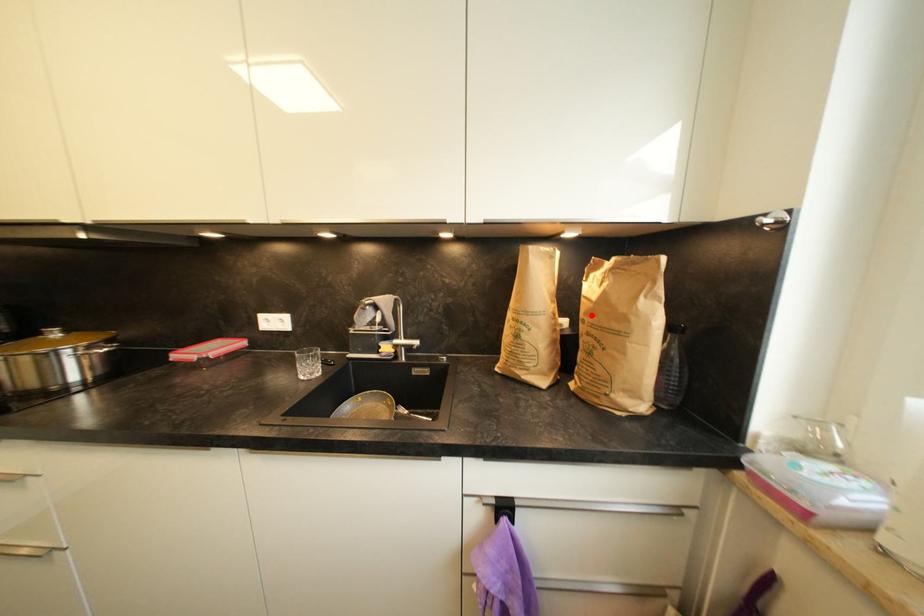
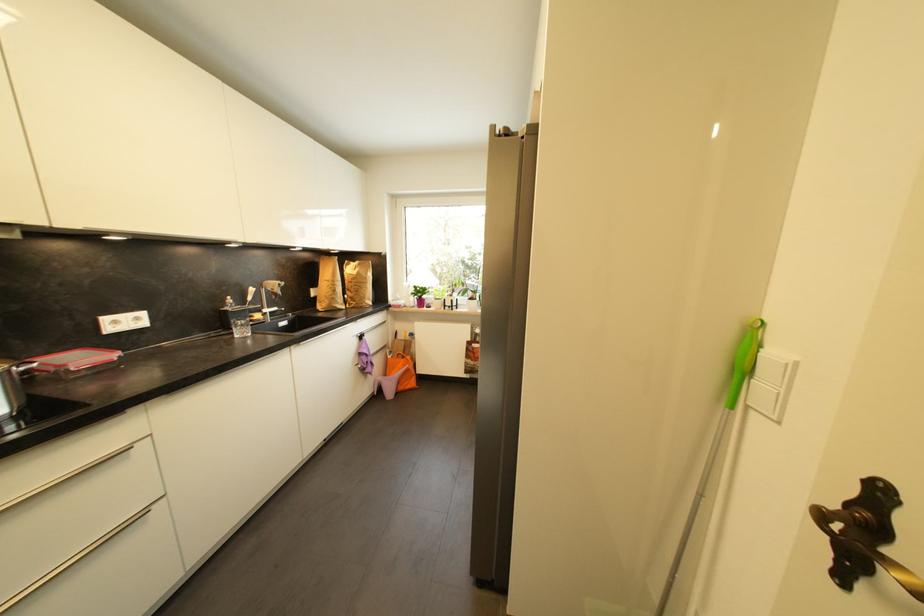
Question: I am providing you with two images of the same scene from different viewpoints. A red point is shown in image1. For the corresponding object point in image2, is it positioned nearer or farther from the camera?

Choices:
 (A) Nearer
 (B) Farther

Answer: (A)